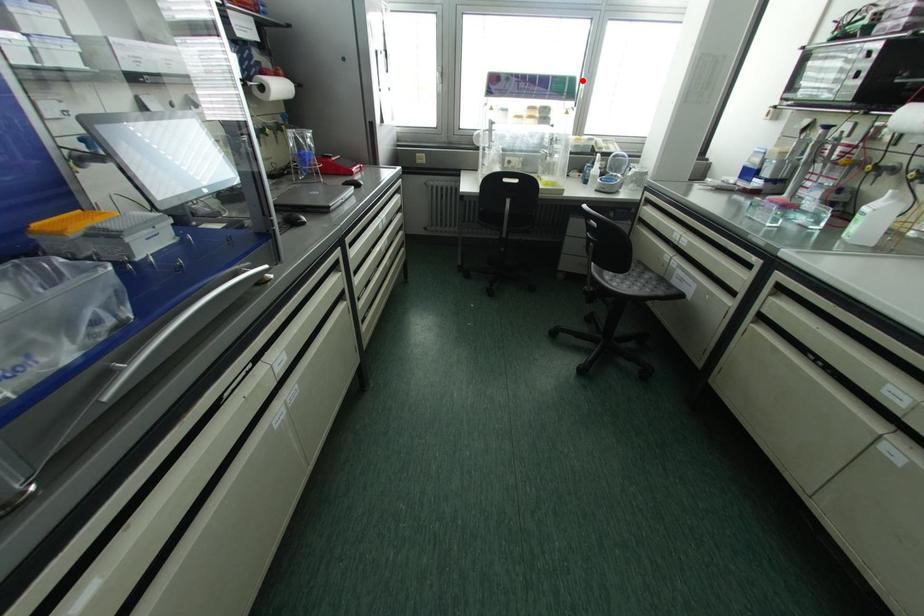
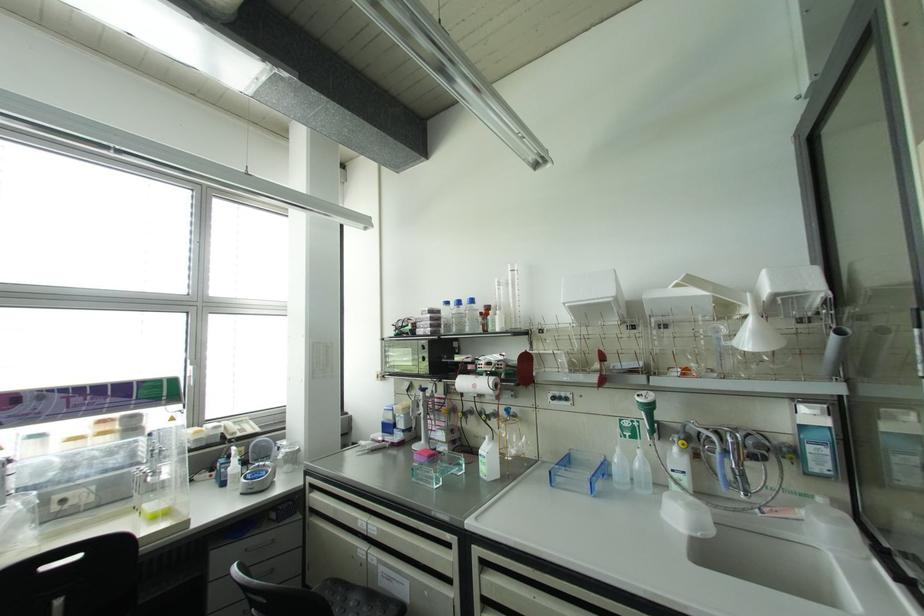
Where in the second image is the point corresponding to the highlighted location from the first image?

(189, 368)